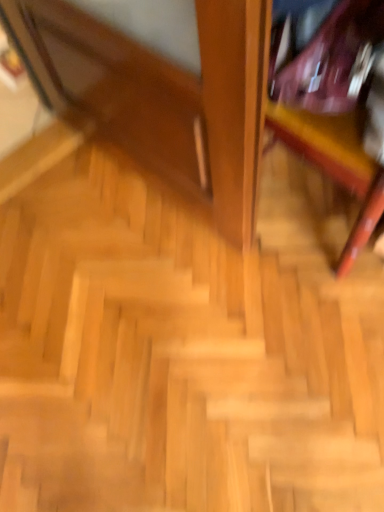
Question: Considering the positions of wooden stairs at center and wooden bookshelf at upper right in the image, is wooden stairs at center bigger or smaller than wooden bookshelf at upper right?

Choices:
 (A) big
 (B) small

Answer: (B)

Question: In terms of width, does wooden stairs at center look wider or thinner when compared to wooden bookshelf at upper right?

Choices:
 (A) thin
 (B) wide

Answer: (B)

Question: Would you say wooden stairs at center is inside or outside wooden bookshelf at upper right?

Choices:
 (A) outside
 (B) inside

Answer: (A)

Question: In the image, is wooden bookshelf at upper right on the left side or the right side of wooden stairs at center?

Choices:
 (A) right
 (B) left

Answer: (A)

Question: Considering the positions of wooden bookshelf at upper right and wooden stairs at center in the image, is wooden bookshelf at upper right bigger or smaller than wooden stairs at center?

Choices:
 (A) small
 (B) big

Answer: (B)

Question: Is point (357, 242) closer or farther from the camera than point (31, 207)?

Choices:
 (A) closer
 (B) farther

Answer: (A)

Question: Considering the positions of wooden bookshelf at upper right and wooden stairs at center in the image, is wooden bookshelf at upper right wider or thinner than wooden stairs at center?

Choices:
 (A) wide
 (B) thin

Answer: (B)